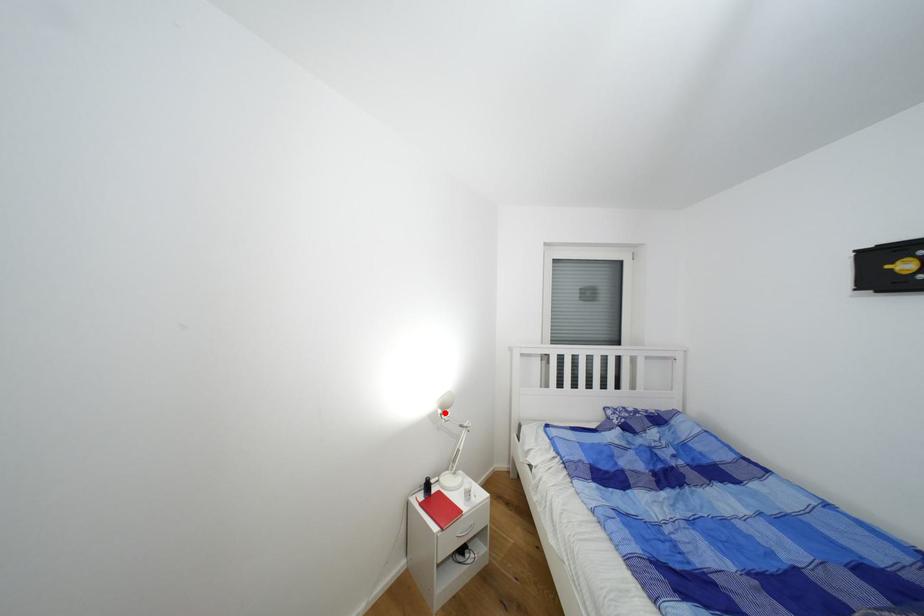
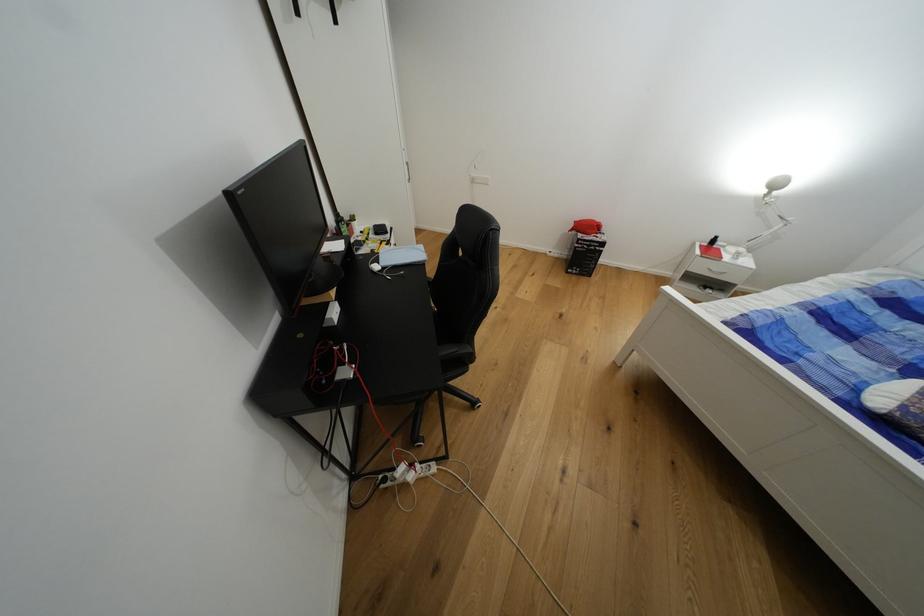
Find the pixel in the second image that matches the highlighted location in the first image.

(771, 193)